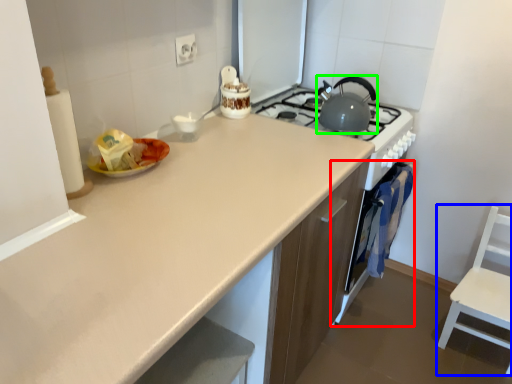
Question: Estimate the real-world distances between objects in this image. Which object is farther from oven (highlighted by a red box), chair (highlighted by a blue box) or kitchen appliance (highlighted by a green box)?

Choices:
 (A) chair
 (B) kitchen appliance

Answer: (B)